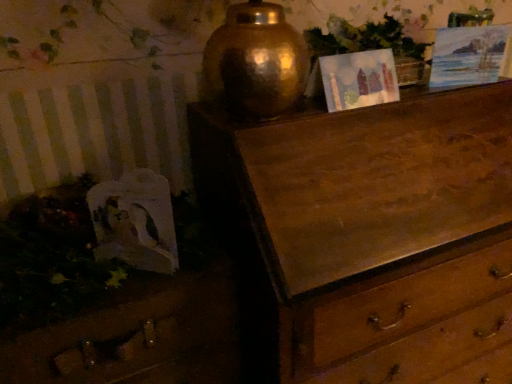
Question: Considering the relative sizes of wooden drawer at lower left and watercolor paper picture frame at upper right, placed as the first picture frame when sorted from right to left, in the image provided, is wooden drawer at lower left smaller than watercolor paper picture frame at upper right, placed as the first picture frame when sorted from right to left,?

Choices:
 (A) no
 (B) yes

Answer: (A)

Question: Is wooden drawer at lower left to the left of watercolor paper picture frame at upper right, acting as the 2th picture frame starting from the left, from the viewer's perspective?

Choices:
 (A) no
 (B) yes

Answer: (B)

Question: From the image's perspective, is wooden drawer at lower left located above watercolor paper picture frame at upper right, placed as the first picture frame when sorted from right to left?

Choices:
 (A) no
 (B) yes

Answer: (A)

Question: From the image's perspective, would you say wooden drawer at lower left is shown under watercolor paper picture frame at upper right, acting as the 2th picture frame starting from the left?

Choices:
 (A) yes
 (B) no

Answer: (A)

Question: Considering the relative positions of wooden drawer at lower left and watercolor paper picture frame at upper right, placed as the first picture frame when sorted from right to left, in the image provided, is wooden drawer at lower left to the right of watercolor paper picture frame at upper right, placed as the first picture frame when sorted from right to left, from the viewer's perspective?

Choices:
 (A) yes
 (B) no

Answer: (B)

Question: Is wooden drawer at lower left bigger or smaller than matte paper picture frame at upper center, which is counted as the first picture frame, starting from the left?

Choices:
 (A) small
 (B) big

Answer: (B)

Question: From a real-world perspective, is wooden drawer at lower left physically located above or below matte paper picture frame at upper center, the 2th picture frame in the right-to-left sequence?

Choices:
 (A) above
 (B) below

Answer: (B)

Question: From the image's perspective, is wooden drawer at lower left located above or below matte paper picture frame at upper center, the 2th picture frame in the right-to-left sequence?

Choices:
 (A) below
 (B) above

Answer: (A)

Question: Would you say wooden drawer at lower left is to the left or to the right of matte paper picture frame at upper center, which is counted as the first picture frame, starting from the left, in the picture?

Choices:
 (A) right
 (B) left

Answer: (B)

Question: Is wooden drawer at lower left to the left or to the right of green leafy plant at upper center in the image?

Choices:
 (A) left
 (B) right

Answer: (A)

Question: Is wooden drawer at lower left in front of or behind green leafy plant at upper center in the image?

Choices:
 (A) behind
 (B) front

Answer: (B)

Question: Looking at the image, does wooden drawer at lower left seem bigger or smaller compared to green leafy plant at upper center?

Choices:
 (A) small
 (B) big

Answer: (B)

Question: Considering the positions of wooden drawer at lower left and green leafy plant at upper center in the image, is wooden drawer at lower left wider or thinner than green leafy plant at upper center?

Choices:
 (A) wide
 (B) thin

Answer: (A)

Question: From the image's perspective, is green leafy plant at upper center above or below matte paper picture frame at upper center, the 2th picture frame in the right-to-left sequence?

Choices:
 (A) above
 (B) below

Answer: (A)

Question: Would you say green leafy plant at upper center is inside or outside matte paper picture frame at upper center, the 2th picture frame in the right-to-left sequence?

Choices:
 (A) inside
 (B) outside

Answer: (B)